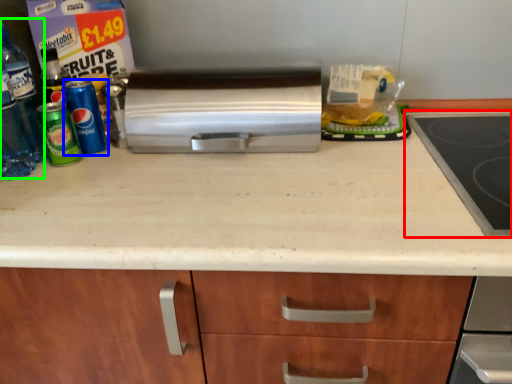
Question: Which is farther away from gas stove (highlighted by a red box)? beverage (highlighted by a blue box) or bottle (highlighted by a green box)?

Choices:
 (A) beverage
 (B) bottle

Answer: (B)